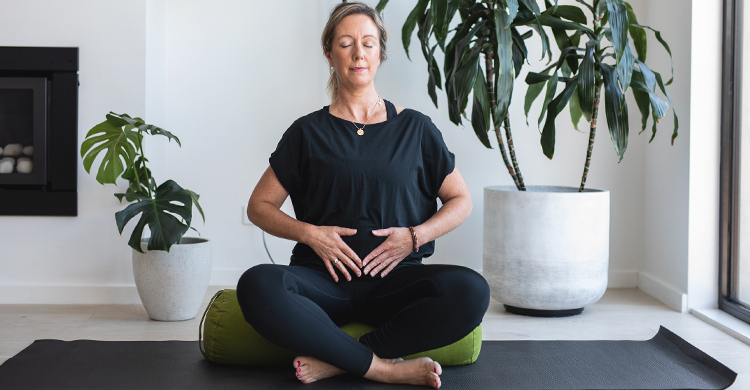
Find the location of a particular element. This screenshot has height=390, width=750. door is located at coordinates (742, 268).